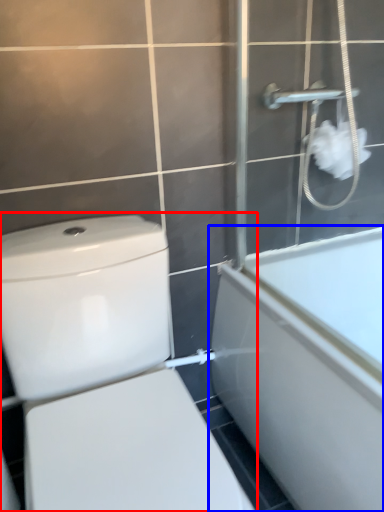
Question: Which point is further to the camera, toilet (highlighted by a red box) or bathtub (highlighted by a blue box)?

Choices:
 (A) toilet
 (B) bathtub

Answer: (B)